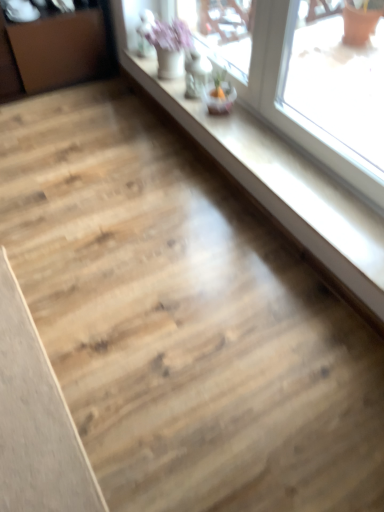
Question: From a real-world perspective, is brown wood dresser at left positioned under light brown wood plank at lower left based on gravity?

Choices:
 (A) no
 (B) yes

Answer: (A)

Question: Is brown wood dresser at left at the right side of light brown wood plank at lower left?

Choices:
 (A) no
 (B) yes

Answer: (A)

Question: Can light brown wood plank at lower left be found inside brown wood dresser at left?

Choices:
 (A) no
 (B) yes

Answer: (A)

Question: Is brown wood dresser at left oriented towards light brown wood plank at lower left?

Choices:
 (A) yes
 (B) no

Answer: (A)

Question: Considering the relative sizes of brown wood dresser at left and light brown wood plank at lower left in the image provided, is brown wood dresser at left wider than light brown wood plank at lower left?

Choices:
 (A) no
 (B) yes

Answer: (A)

Question: From a real-world perspective, is brown wood dresser at left over light brown wood plank at lower left?

Choices:
 (A) no
 (B) yes

Answer: (B)

Question: From a real-world perspective, is brown wood dresser at left physically above transparent glass window at upper right?

Choices:
 (A) yes
 (B) no

Answer: (A)

Question: Is transparent glass window at upper right at the back of brown wood dresser at left?

Choices:
 (A) yes
 (B) no

Answer: (B)

Question: Is brown wood dresser at left beside transparent glass window at upper right?

Choices:
 (A) yes
 (B) no

Answer: (B)

Question: Can you confirm if brown wood dresser at left is bigger than transparent glass window at upper right?

Choices:
 (A) yes
 (B) no

Answer: (A)

Question: Does brown wood dresser at left have a smaller size compared to transparent glass window at upper right?

Choices:
 (A) yes
 (B) no

Answer: (B)

Question: Can you confirm if brown wood dresser at left is thinner than transparent glass window at upper right?

Choices:
 (A) yes
 (B) no

Answer: (B)

Question: Is light brown wood plank at lower left positioned behind transparent glass window at upper right?

Choices:
 (A) no
 (B) yes

Answer: (A)